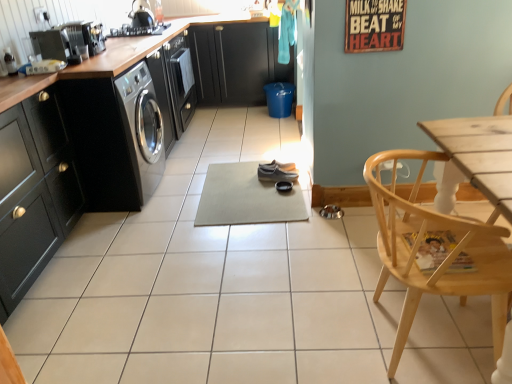
Question: From a real-world perspective, is matte black cabinet at left, acting as the second cabinetry starting from the top, positioned above or below matte gray shoe at center?

Choices:
 (A) above
 (B) below

Answer: (A)

Question: Looking at their shapes, would you say matte black cabinet at left, positioned as the 1th cabinetry in left-to-right order, is wider or thinner than matte gray shoe at center?

Choices:
 (A) thin
 (B) wide

Answer: (B)

Question: Which object is the closest to the shiny black kettle at upper left?

Choices:
 (A) beige rubber yoga mat at center
 (B) matte black cabinet at left, acting as the second cabinetry starting from the top
 (C) light wood chair at lower right
 (D) matte gray shoe at center
 (E) matte black cabinets at center, positioned as the 2th cabinetry in left-to-right order

Answer: (E)

Question: Considering the real-world distances, which object is farthest from the wooden at left?

Choices:
 (A) beige rubber yoga mat at center
 (B) matte black cabinet at left, acting as the second cabinetry starting from the top
 (C) matte black cabinets at center, positioned as the 1th cabinetry in top-to-bottom order
 (D) light wood chair at lower right
 (E) matte gray shoe at center

Answer: (D)